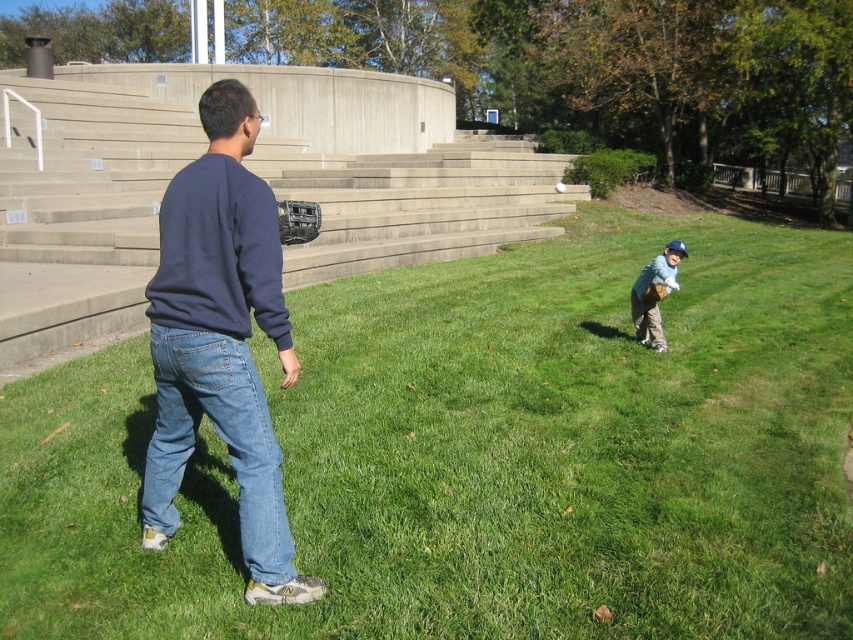
Is dark blue sweatshirt at center to the right of light blue jersey at lower right from the viewer's perspective?

No, dark blue sweatshirt at center is not to the right of light blue jersey at lower right.

Is dark blue sweatshirt at center positioned at the back of light blue jersey at lower right?

No, dark blue sweatshirt at center is closer to the viewer.

Locate an element on the screen. Image resolution: width=853 pixels, height=640 pixels. dark blue sweatshirt at center is located at coordinates (221, 342).

Does denim jeans at lower left appear on the right side of light blue jersey at lower right?

No, denim jeans at lower left is not to the right of light blue jersey at lower right.

Is point (264, 508) positioned behind point (657, 348)?

That is False.

Is point (166, 384) farther from camera compared to point (648, 300)?

That is False.

Find the location of a particular element. denim jeans at lower left is located at coordinates (219, 436).

Does green grass at center have a lesser height compared to dark blue sweatshirt at center?

Yes.

Who is more forward, [285,392] or [253,417]?

Positioned in front is point [253,417].

Which is in front, point (529, 588) or point (183, 284)?

Point (183, 284) is more forward.

Find the location of a particular element. This screenshot has height=640, width=853. green grass at center is located at coordinates (480, 454).